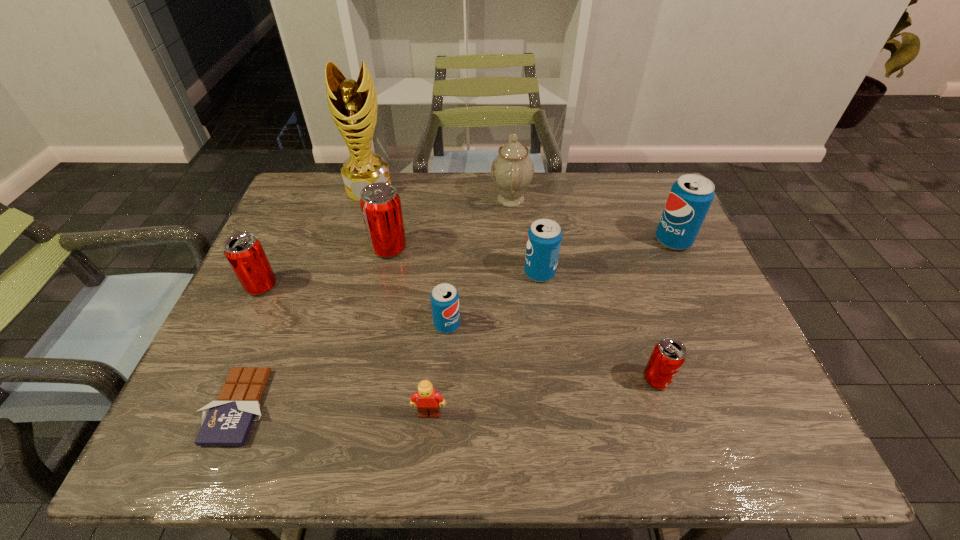
At what (x,y) coordinates should I click in order to perform the action: click on the tallest object. Please return your answer as a coordinate pair (x, y). The image size is (960, 540). Looking at the image, I should click on (353, 105).

Find the location of a particular element. Image resolution: width=960 pixels, height=540 pixels. award is located at coordinates (353, 105).

I want to click on chinaware, so click(x=512, y=170).

Identify the location of the rightmost object. Image resolution: width=960 pixels, height=540 pixels. (690, 198).

This screenshot has width=960, height=540. Find the location of `the farthest blue soda can`. the farthest blue soda can is located at coordinates (690, 198).

Where is `the biggest red soda can`? The image size is (960, 540). the biggest red soda can is located at coordinates (380, 203).

Identify the location of the farthest red soda can. The width and height of the screenshot is (960, 540). [380, 203].

The image size is (960, 540). In order to click on the third soda can from right to left in this screenshot , I will do `click(544, 238)`.

Locate an element on the screen. This screenshot has height=540, width=960. the second biggest blue soda can is located at coordinates (544, 238).

The height and width of the screenshot is (540, 960). Identify the location of the second farthest red soda can. (x=244, y=252).